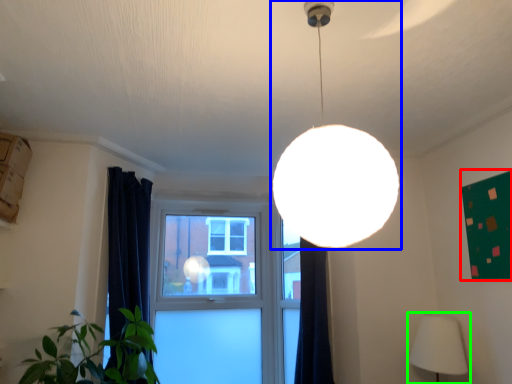
Question: Which object is the closest to the bulletin board (highlighted by a red box)? Choose among these: lamp (highlighted by a blue box) or lamp (highlighted by a green box).

Choices:
 (A) lamp
 (B) lamp

Answer: (B)